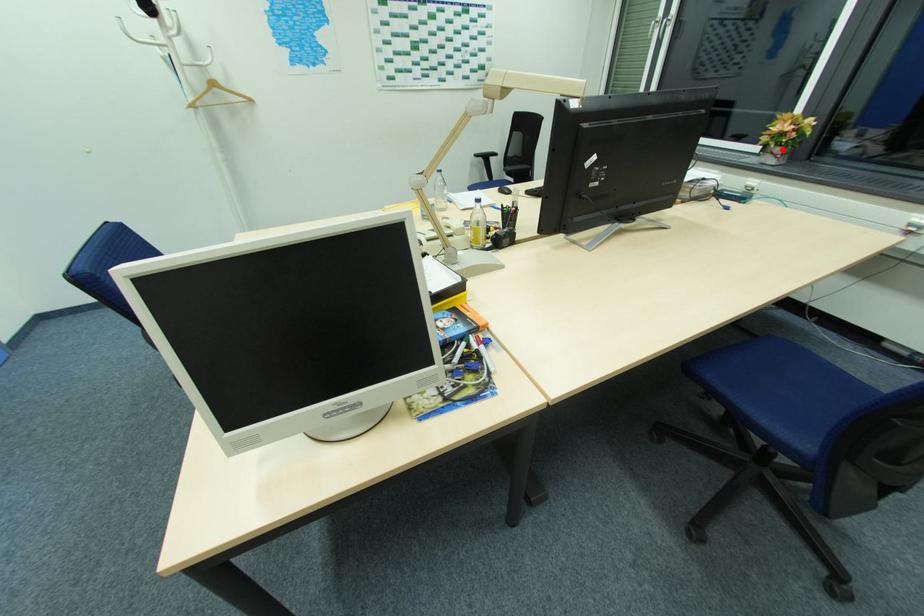
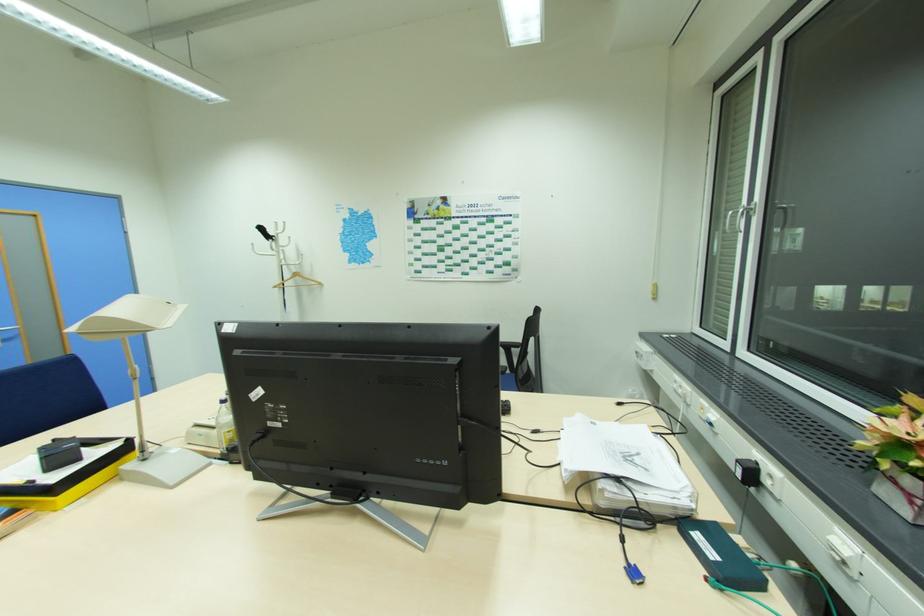
Question: I am providing you with two images of the same scene from different viewpoints. Image1 has a red point marked. In image2, the corresponding 3D location appears at what relative position? Reply with the corresponding letter.

Choices:
 (A) Closer
 (B) Farther

Answer: (A)